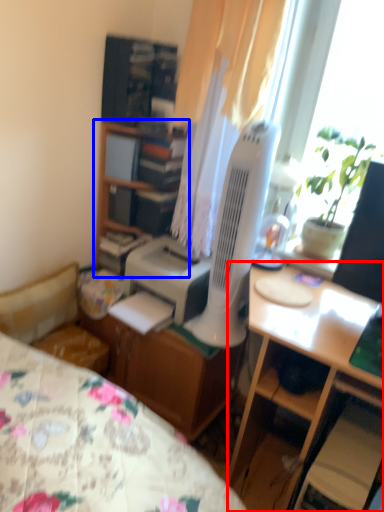
Question: Which point is closer to the camera, desk (highlighted by a red box) or cabinetry (highlighted by a blue box)?

Choices:
 (A) desk
 (B) cabinetry

Answer: (A)